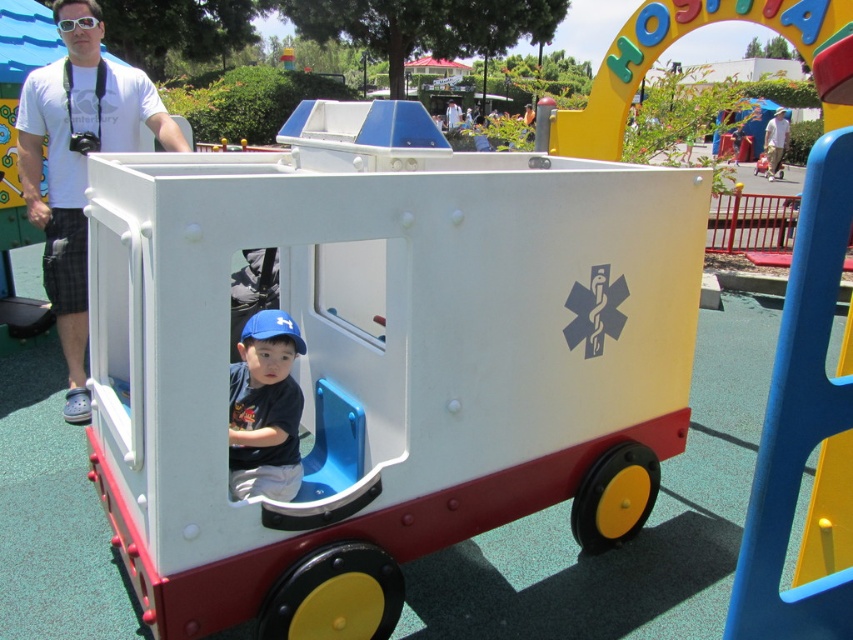
Is point (538, 180) behind point (107, 116)?

No, it is not.

Can you confirm if white plastic toy car at center is taller than white t-shirt at upper left?

Incorrect, white plastic toy car at center's height is not larger of white t-shirt at upper left's.

Where is `white plastic toy car at center`? The image size is (853, 640). white plastic toy car at center is located at coordinates (383, 358).

Is point (71, 392) less distant than point (769, 170)?

Yes, point (71, 392) is closer to viewer.

Does point (32, 209) come behind point (770, 177)?

No, it is not.

This screenshot has height=640, width=853. Find the location of `white t-shirt at upper left`. white t-shirt at upper left is located at coordinates (78, 163).

Is blue matte shirt at center below white matte shirt at upper left?

Yes, blue matte shirt at center is below white matte shirt at upper left.

Can you confirm if blue matte shirt at center is positioned above white matte shirt at upper left?

No.

Describe the element at coordinates (265, 410) in the screenshot. This screenshot has width=853, height=640. I see `blue matte shirt at center` at that location.

At what (x,y) coordinates should I click in order to perform the action: click on blue matte shirt at center. Please return your answer as a coordinate pair (x, y). The width and height of the screenshot is (853, 640). Looking at the image, I should click on (265, 410).